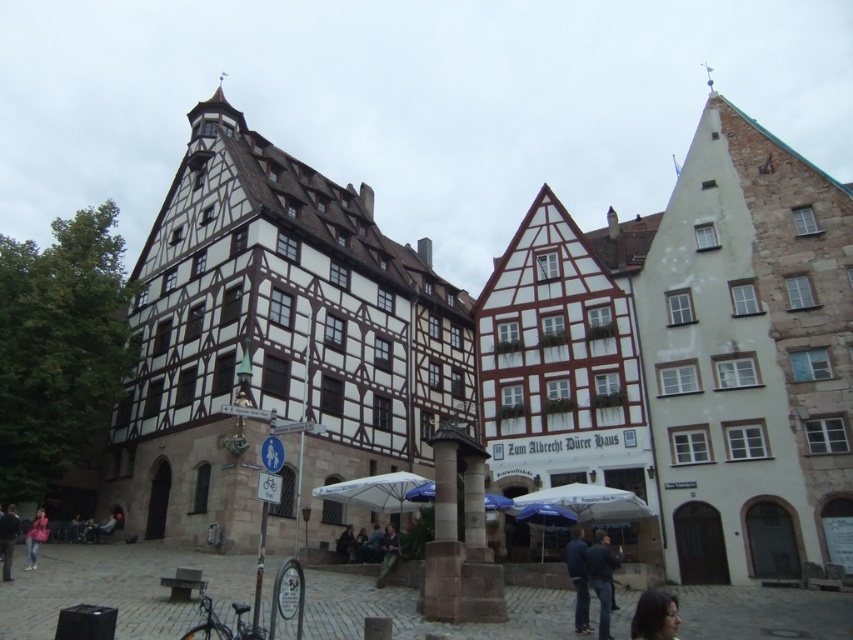
Question: Which point appears closest to the camera in this image?

Choices:
 (A) (570, 547)
 (B) (614, 556)
 (C) (0, 557)

Answer: (B)

Question: Is dark blue jacket at lower right smaller than dark blue jeans at center?

Choices:
 (A) no
 (B) yes

Answer: (A)

Question: Which of the following is the closest to the observer?

Choices:
 (A) (552, 520)
 (B) (335, 554)

Answer: (A)

Question: Which point appears farthest from the camera in this image?

Choices:
 (A) (598, 593)
 (B) (395, 552)

Answer: (B)

Question: Can you confirm if blue fabric umbrella at lower center is thinner than dark blue jeans at lower left?

Choices:
 (A) yes
 (B) no

Answer: (A)

Question: Can you confirm if dark green fabric jacket at center is wider than dark blue jeans at center?

Choices:
 (A) yes
 (B) no

Answer: (A)